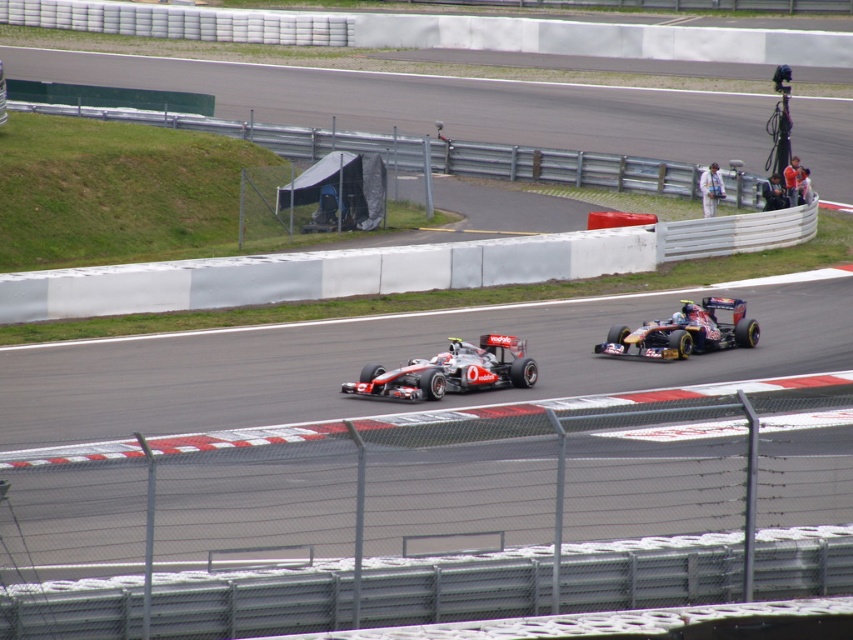
Question: Is silver metallic race car at center bigger than shiny metallic race car at center?

Choices:
 (A) yes
 (B) no

Answer: (B)

Question: Which point is closer to the camera taking this photo?

Choices:
 (A) (686, 304)
 (B) (500, 342)

Answer: (B)

Question: Can you confirm if silver metallic race car at center is positioned above shiny metallic race car at center?

Choices:
 (A) yes
 (B) no

Answer: (B)

Question: Can you confirm if silver metallic race car at center is thinner than shiny metallic race car at center?

Choices:
 (A) no
 (B) yes

Answer: (A)